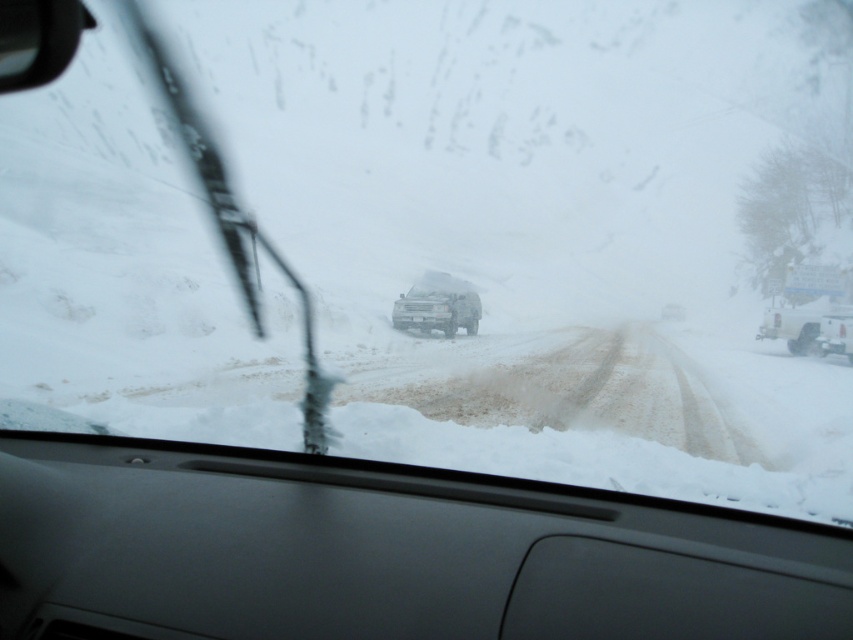
Is point (155, 442) more distant than point (439, 289)?

No, (155, 442) is closer to viewer.

The image size is (853, 640). What do you see at coordinates (384, 552) in the screenshot?
I see `gray matte dashboard at center` at bounding box center [384, 552].

Who is more distant from viewer, (28, 628) or (431, 282)?

Point (431, 282)

Locate an element on the screen. The image size is (853, 640). gray matte dashboard at center is located at coordinates (384, 552).

Does gray matte dashboard at center appear over clear glass windshield at center?

Actually, gray matte dashboard at center is below clear glass windshield at center.

This screenshot has height=640, width=853. Describe the element at coordinates (384, 552) in the screenshot. I see `gray matte dashboard at center` at that location.

Image resolution: width=853 pixels, height=640 pixels. What are the coordinates of `gray matte dashboard at center` in the screenshot? It's located at (384, 552).

Does gray matte dashboard at center have a greater width compared to white matte truck at right?

No, gray matte dashboard at center is not wider than white matte truck at right.

Between gray matte dashboard at center and white matte truck at right, which one has less height?

With less height is gray matte dashboard at center.

Locate an element on the screen. The image size is (853, 640). gray matte dashboard at center is located at coordinates (384, 552).